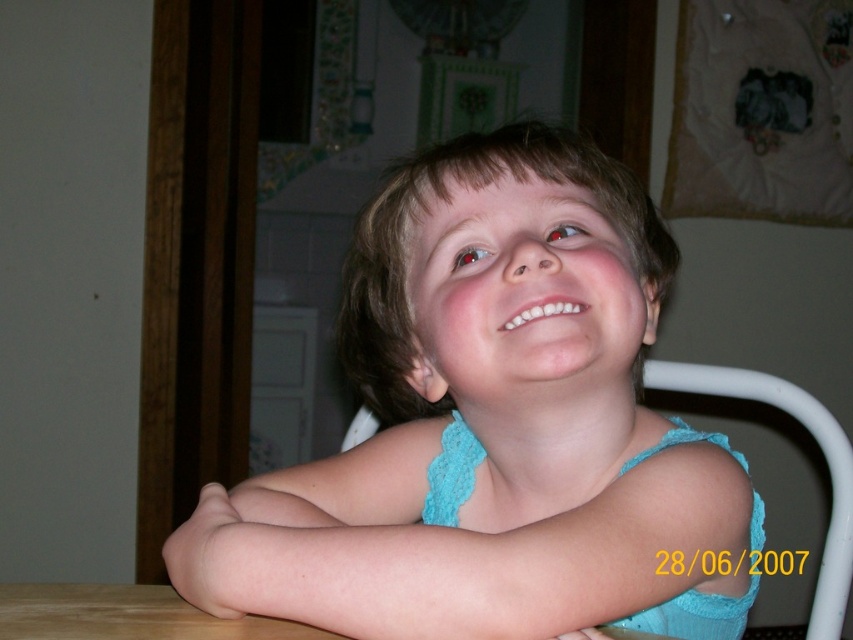
Question: Estimate the real-world distances between objects in this image. Which object is farther from the light blue fabric at center?

Choices:
 (A) smooth skin at lower center
 (B) white plastic chair at center

Answer: (B)

Question: Is light blue fabric at center positioned at the back of smooth skin at lower center?

Choices:
 (A) yes
 (B) no

Answer: (B)

Question: Is light blue fabric at center below white plastic chair at center?

Choices:
 (A) no
 (B) yes

Answer: (A)

Question: Can you confirm if smooth skin at lower center is wider than white plastic chair at center?

Choices:
 (A) no
 (B) yes

Answer: (B)

Question: Which point is farther from the camera taking this photo?

Choices:
 (A) click(x=659, y=388)
 (B) click(x=602, y=467)

Answer: (A)

Question: Estimate the real-world distances between objects in this image. Which object is farther from the white plastic chair at center?

Choices:
 (A) smooth skin at lower center
 (B) light blue fabric at center

Answer: (A)